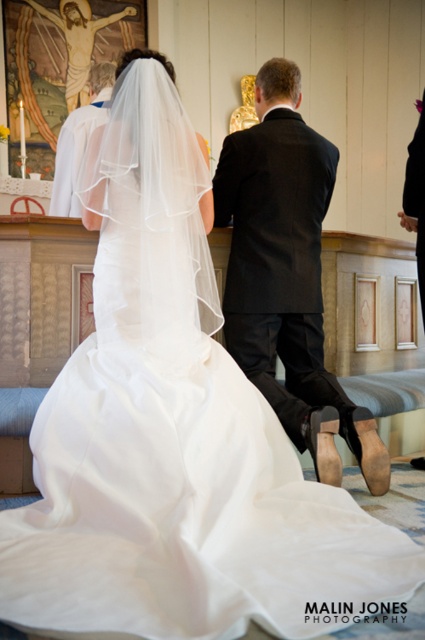
Is black satin suit at center shorter than matte white robe at upper center?

In fact, black satin suit at center may be taller than matte white robe at upper center.

Between point (289, 314) and point (81, 214), which one is positioned behind?

The point (81, 214) is more distant.

At what (x,y) coordinates should I click in order to perform the action: click on black satin suit at center. Please return your answer as a coordinate pair (x, y). Looking at the image, I should click on (286, 275).